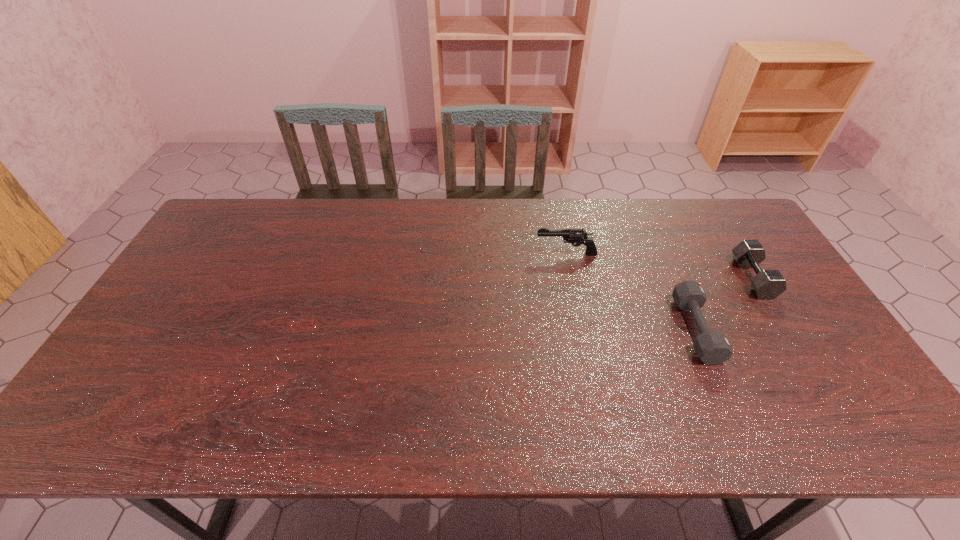
Image resolution: width=960 pixels, height=540 pixels. In the image, there is a desktop. What are the coordinates of `vacant space at the far edge` in the screenshot? It's located at (324, 216).

You are a GUI agent. You are given a task and a screenshot of the screen. Output one action in this format:
    pyautogui.click(x=<x>, y=<y>)
    Task: Click on the vacant space at the near edge of the desktop
    This screenshot has width=960, height=540.
    Given the screenshot: What is the action you would take?
    pyautogui.click(x=335, y=414)

The height and width of the screenshot is (540, 960). I want to click on free space at the right edge, so click(x=830, y=404).

I want to click on vacant space that is in between the left dumbbell and the right dumbbell, so click(724, 304).

This screenshot has height=540, width=960. I want to click on free space between the tallest object and the second object from left to right, so click(x=631, y=292).

What are the coordinates of `vacant area that lies between the second object from left to right and the rightmost object` in the screenshot? It's located at (x=724, y=304).

Locate an element on the screen. The width and height of the screenshot is (960, 540). vacant area between the second object from left to right and the gun is located at coordinates (631, 292).

This screenshot has height=540, width=960. Identify the location of vacant area between the right dumbbell and the gun. tap(660, 266).

Locate an element on the screen. The height and width of the screenshot is (540, 960). blank region between the rightmost object and the gun is located at coordinates (660, 266).

I want to click on vacant space in between the gun and the left dumbbell, so click(631, 292).